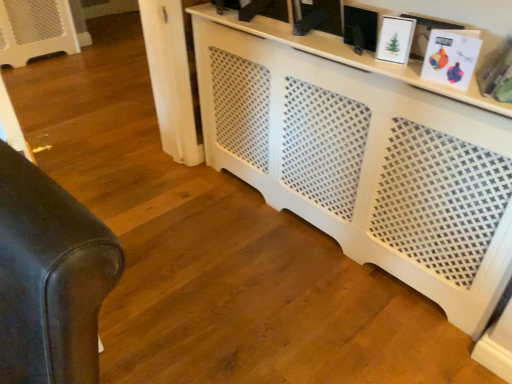
This screenshot has height=384, width=512. Identify the location of free space to the left of white glossy picture frame at upper right, the 2th picture frame positioned from the right. (355, 55).